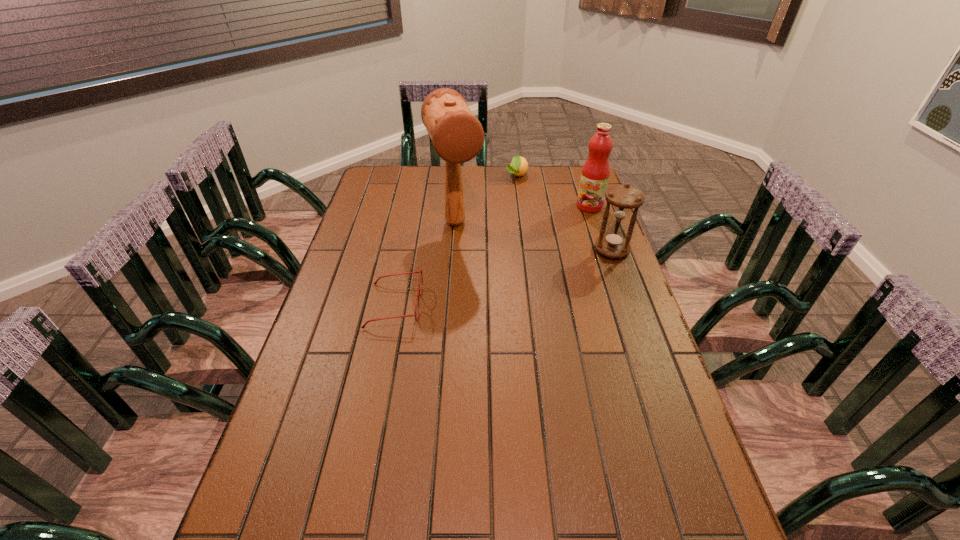
Locate an element on the screen. This screenshot has width=960, height=540. the nearest object is located at coordinates (420, 271).

At what (x,y) coordinates should I click in order to perform the action: click on spectacles. Please return your answer as a coordinate pair (x, y). This screenshot has height=540, width=960. Looking at the image, I should click on point(420,271).

Where is `the third tallest object`? the third tallest object is located at coordinates (614, 244).

Locate an element on the screen. The height and width of the screenshot is (540, 960). the third object from right to left is located at coordinates (519, 165).

You are a GUI agent. You are given a task and a screenshot of the screen. Output one action in this format:
    pyautogui.click(x=<x>, y=<y>)
    Task: Click on the lemon
    The width and height of the screenshot is (960, 540).
    Given the screenshot: What is the action you would take?
    pyautogui.click(x=519, y=165)

Locate an element on the screen. The height and width of the screenshot is (540, 960). fruit juice is located at coordinates (595, 174).

Find the location of `mallet`. mallet is located at coordinates (457, 135).

Image resolution: width=960 pixels, height=540 pixels. Find the location of `vacant space positioned on the face of the spectacles`. vacant space positioned on the face of the spectacles is located at coordinates (442, 305).

This screenshot has height=540, width=960. What are the coordinates of `vacant space located on the left of the third shortest object` in the screenshot? It's located at (576, 250).

This screenshot has width=960, height=540. In order to click on vacant space located 0.320m with leaves positioned above the lemon in this screenshot , I will do `click(505, 227)`.